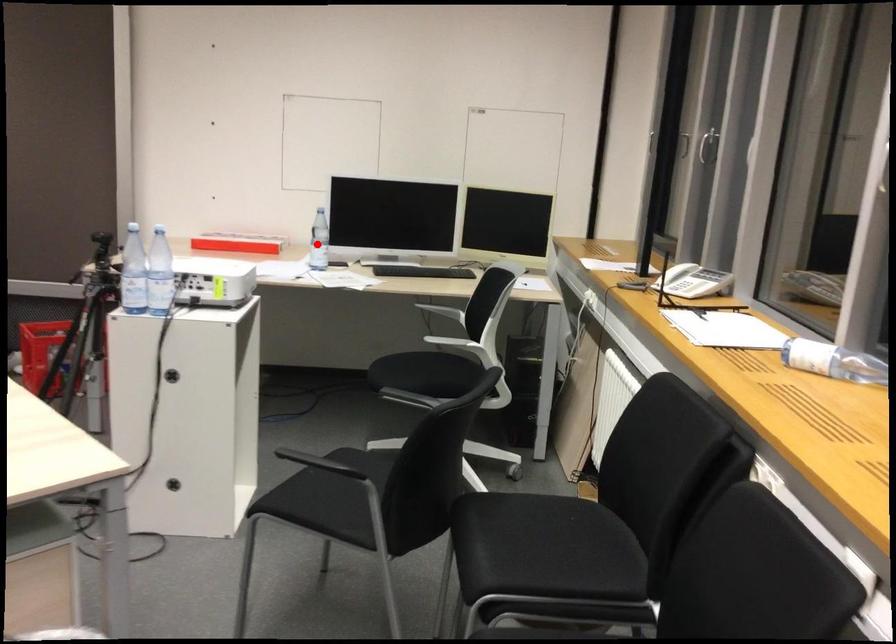
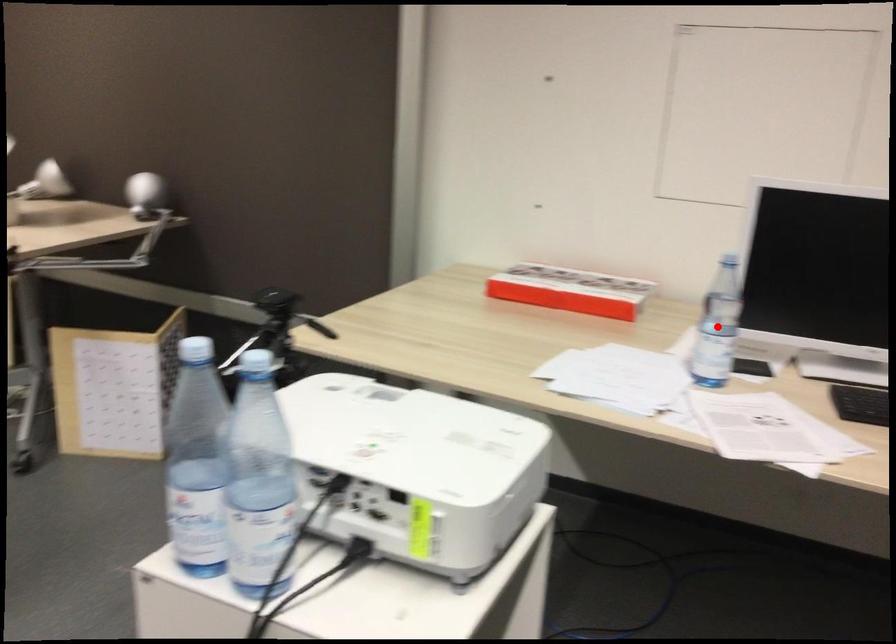
I am providing you with two images of the same scene from different viewpoints. A red point is marked on the first image and another point is marked on the second image. Is the red point in image1 aligned with the point shown in image2?

Yes